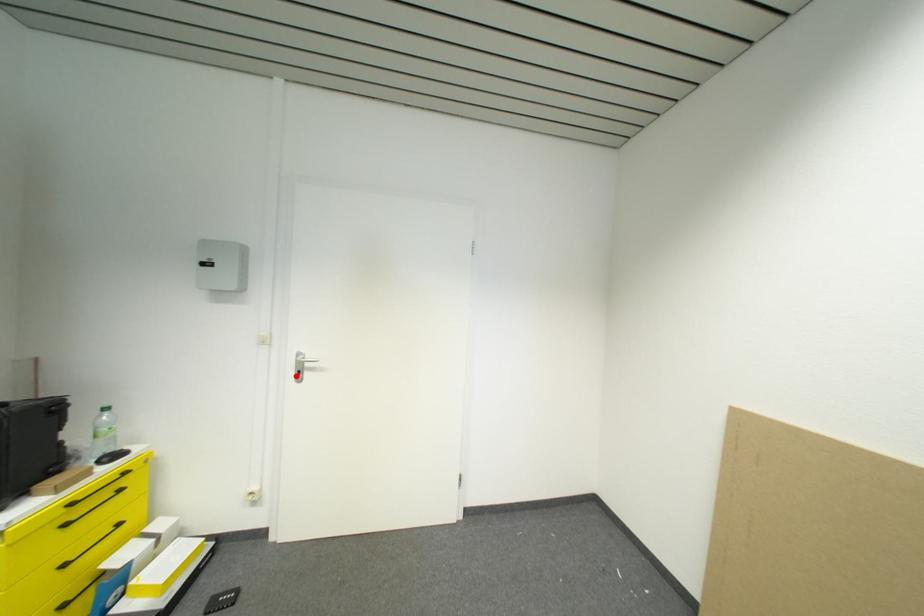
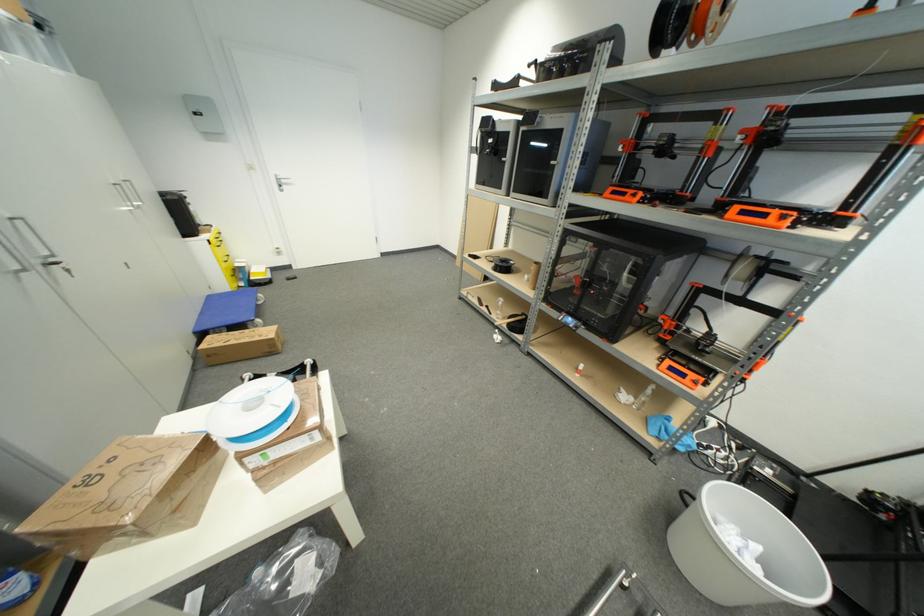
The point at the highlighted location is marked in the first image. Where is the corresponding point in the second image?

(281, 188)